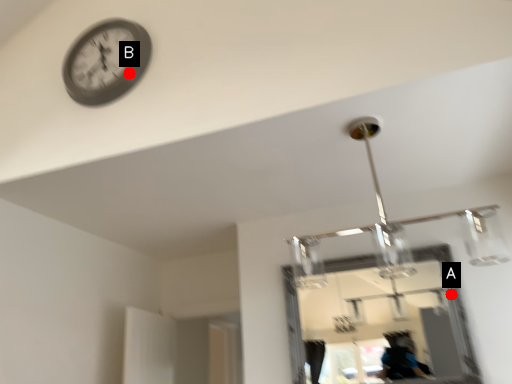
Question: Two points are circled on the image, labeled by A and B beside each circle. Among these points, which one is nearest to the camera?

Choices:
 (A) A is closer
 (B) B is closer

Answer: (B)